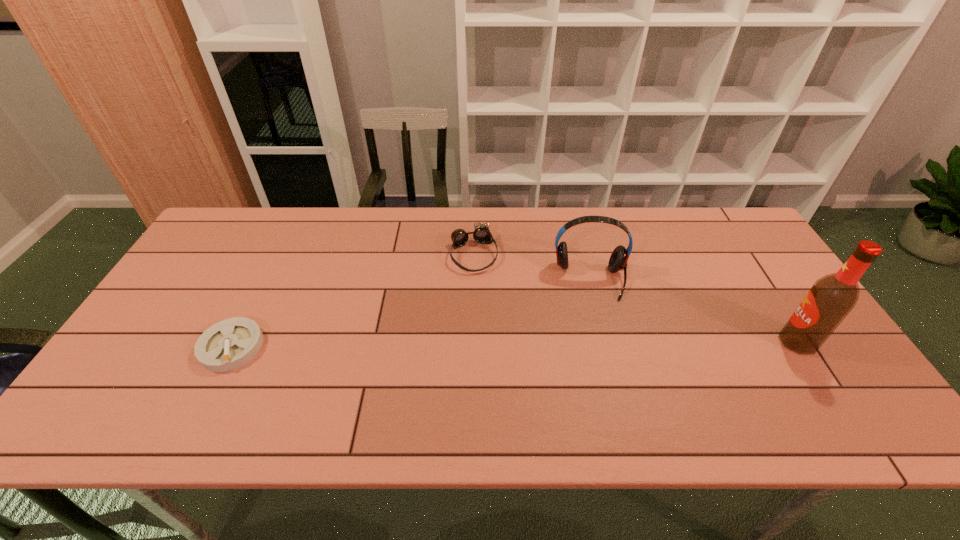
Locate an element on the screen. The width and height of the screenshot is (960, 540). free space located 0.270m through the lenses of the third tallest object is located at coordinates (502, 346).

Find the location of a particular element. This screenshot has width=960, height=540. free space located through the lenses of the third tallest object is located at coordinates (510, 372).

At what (x,y) coordinates should I click in order to perform the action: click on free space located 0.200m through the lenses of the third tallest object. Please return your answer as a coordinate pair (x, y). Image resolution: width=960 pixels, height=540 pixels. Looking at the image, I should click on (495, 325).

This screenshot has width=960, height=540. In order to click on vacant space located with the microphone attached to the side of the third shortest object in this screenshot , I will do `click(597, 361)`.

Locate an element on the screen. blank area located 0.140m with the microphone attached to the side of the third shortest object is located at coordinates (595, 341).

I want to click on free space located with the microphone attached to the side of the third shortest object, so click(600, 385).

Locate an element on the screen. The height and width of the screenshot is (540, 960). object that is positioned at the far edge is located at coordinates (481, 234).

This screenshot has height=540, width=960. I want to click on object present at the near edge, so click(229, 344).

I want to click on object at the right edge, so click(832, 297).

Identify the location of vacant space at the far edge. Image resolution: width=960 pixels, height=540 pixels. (640, 209).